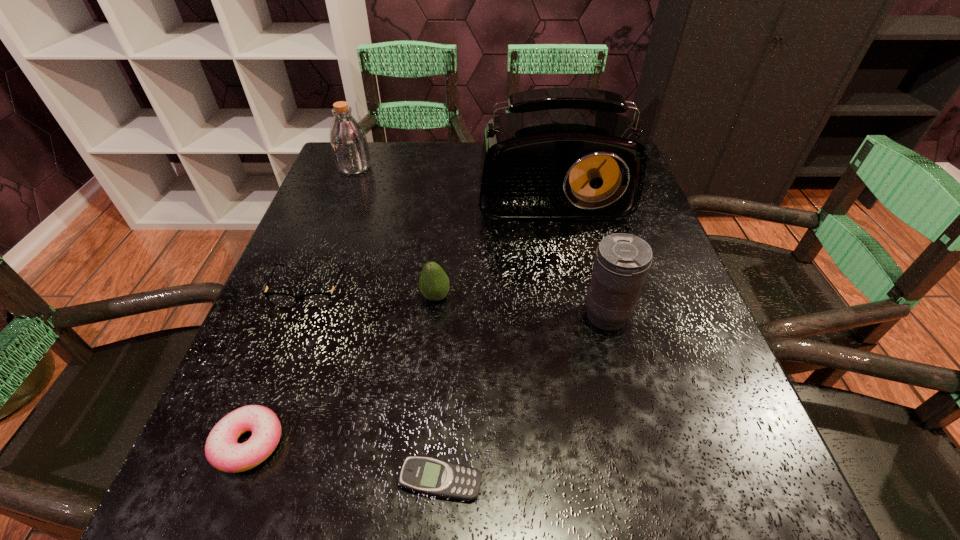
At what (x,y) coordinates should I click in order to perform the action: click on bottle that is at the left edge. Please return your answer as a coordinate pair (x, y). Looking at the image, I should click on (348, 141).

Locate an element on the screen. The width and height of the screenshot is (960, 540). spectacles that is at the left edge is located at coordinates (317, 299).

This screenshot has height=540, width=960. What are the coordinates of `doughnut situated at the left edge` in the screenshot? It's located at (222, 451).

Find the location of a particular element. radio receiver that is positioned at the right edge is located at coordinates 563,153.

At what (x,y) coordinates should I click in order to perform the action: click on telephoto lens present at the right edge. Please return your answer as a coordinate pair (x, y). The width and height of the screenshot is (960, 540). Looking at the image, I should click on (622, 261).

You are a GUI agent. You are given a task and a screenshot of the screen. Output one action in this format:
    pyautogui.click(x=<x>, y=<y>)
    Task: Click on the object at the far left corner
    
    Given the screenshot: What is the action you would take?
    pyautogui.click(x=348, y=141)

Find the location of a particular element. The image size is (960, 540). object that is at the near left corner is located at coordinates (222, 451).

Where is `object present at the far right corner`? object present at the far right corner is located at coordinates (563, 153).

In the image, there is a desktop. Identify the location of vacant area at the far edge. Image resolution: width=960 pixels, height=540 pixels. (459, 152).

At what (x,y) coordinates should I click in order to perform the action: click on free space at the near edge. Please return your answer as a coordinate pair (x, y). The width and height of the screenshot is (960, 540). Looking at the image, I should click on (330, 480).